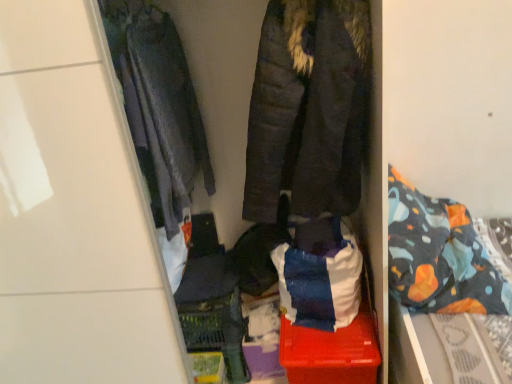
Question: Choose the correct answer: Is dark brown quilted jacket at center, positioned as the 1th jacket in right-to-left order, inside patterned fabric bed at right or outside it?

Choices:
 (A) outside
 (B) inside

Answer: (A)

Question: From a real-world perspective, is dark brown quilted jacket at center, positioned as the 1th jacket in right-to-left order, physically located above or below patterned fabric bed at right?

Choices:
 (A) above
 (B) below

Answer: (A)

Question: Estimate the real-world distances between objects in this image. Which object is closer to the patterned fabric bed at right?

Choices:
 (A) red plastic storage box at center
 (B) dark brown quilted jacket at center, positioned as the 1th jacket in right-to-left order
 (C) textured fabric coat at center
 (D) dark gray quilted jacket at left, which appears as the second jacket when viewed from the right

Answer: (A)

Question: Based on their relative distances, which object is farther from the textured fabric coat at center?

Choices:
 (A) dark gray quilted jacket at left, the 1th jacket in the left-to-right sequence
 (B) dark brown quilted jacket at center, the 2th jacket when ordered from left to right
 (C) red plastic storage box at center
 (D) patterned fabric bed at right

Answer: (C)